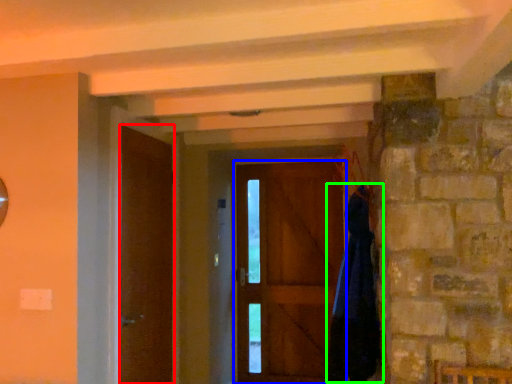
Question: Which is farther away from door (highlighted by a red box)? door (highlighted by a blue box) or cloak (highlighted by a green box)?

Choices:
 (A) door
 (B) cloak

Answer: (A)